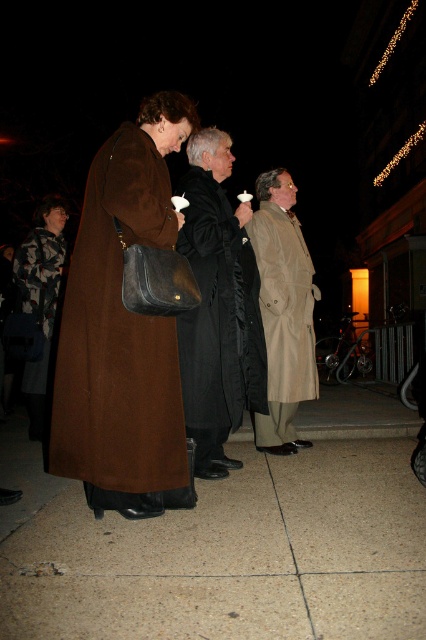
You are a photographer trying to capture a clear shot of both the brown wool coat at left and the tan leather coat at center. Since you want to ensure both coats are in focus, you need to know their sizes. Which coat is bigger?

The brown wool coat at left has a larger size compared to the tan leather coat at center, so the brown wool coat at left is bigger.

Consider the image. You are a photographer setting up a tripod to capture the three individuals holding candles. The tripod has a width of 1.2 meters. You need to position it between the brown wool coat at left and the camouflage fabric jacket at lower left. Will the tripod fit between them without overlapping either?

The brown wool coat at left might be wider than camouflage fabric jacket at lower left, so the distance between them is uncertain. The tripod requires 1.2 meters of space. Without knowing the exact distance between the two coats, it is impossible to determine if the tripod will fit.